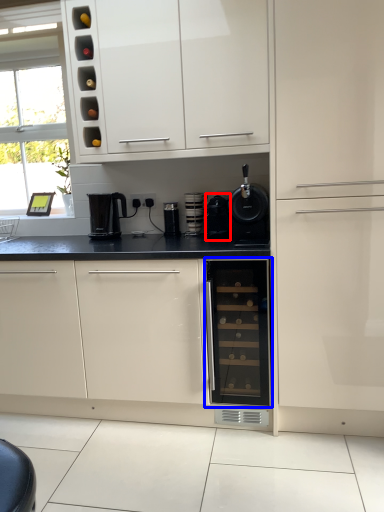
Question: Which point is further to the camera, appliance (highlighted by a red box) or home appliance (highlighted by a blue box)?

Choices:
 (A) appliance
 (B) home appliance

Answer: (A)